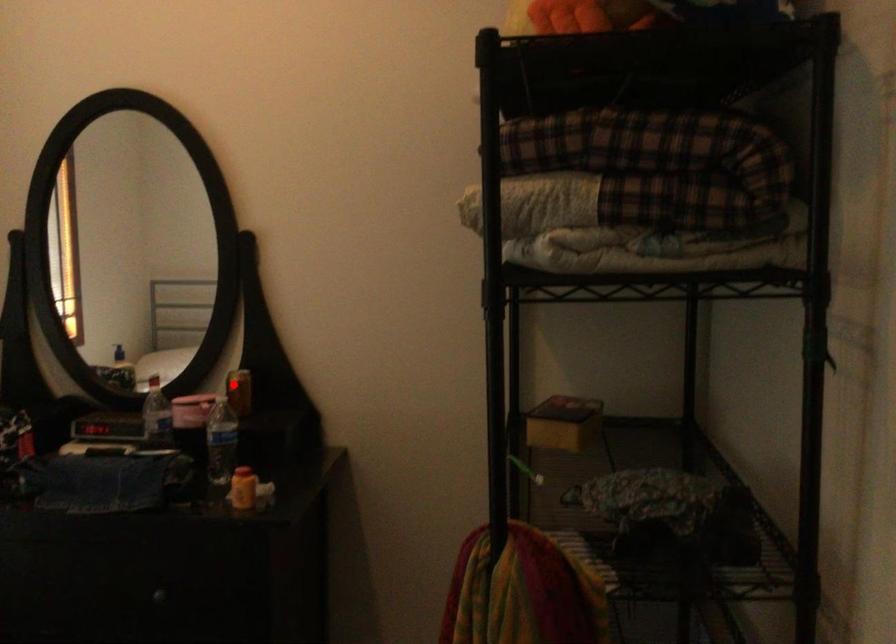
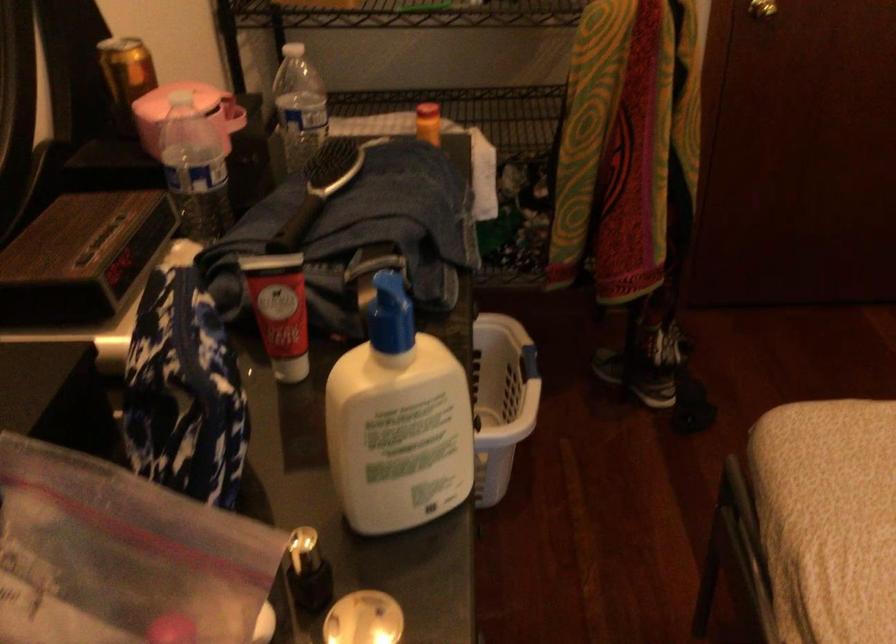
Question: I am providing you with two images of the same scene from different viewpoints. In image1, a red point is highlighted. Considering the same 3D point in image2, which of the following is correct?

Choices:
 (A) It is closer
 (B) It is farther

Answer: (A)